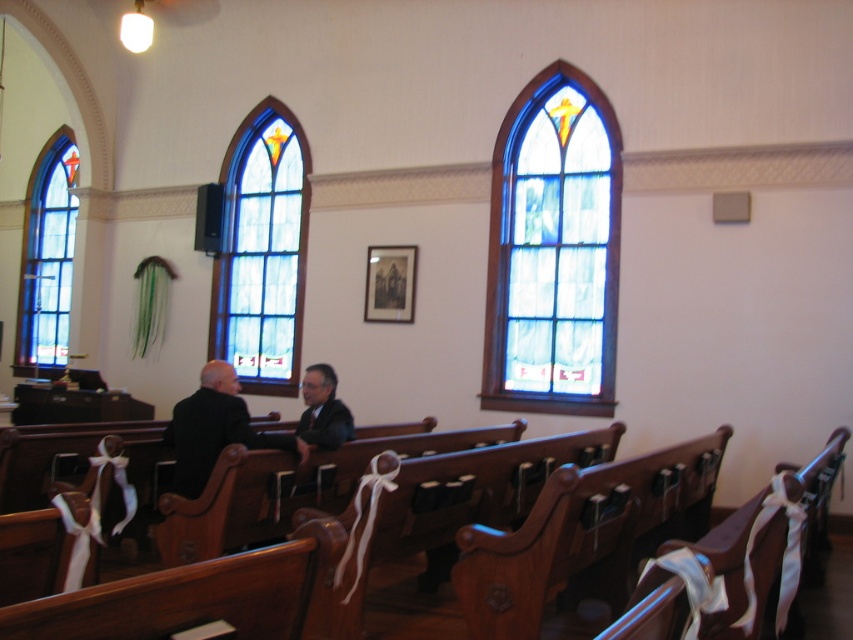
Which is above, stained glass at right or blue stained glass window at center?

Positioned higher is blue stained glass window at center.

This screenshot has width=853, height=640. In order to click on stained glass at right in this screenshot , I will do `click(553, 250)`.

Does point (563, 314) come closer to viewer compared to point (38, 196)?

That is True.

Based on the photo, which of these two, stained glass at right or blue stained glass window at left, stands shorter?

With less height is blue stained glass window at left.

I want to click on stained glass at right, so click(x=553, y=250).

The width and height of the screenshot is (853, 640). In order to click on stained glass at right in this screenshot , I will do `click(553, 250)`.

Describe the element at coordinates (262, 250) in the screenshot. I see `blue stained glass window at center` at that location.

Looking at this image, is blue stained glass window at center shorter than blue stained glass window at left?

No, blue stained glass window at center is not shorter than blue stained glass window at left.

Consider the image. Who is more distant from viewer, (254, 252) or (32, 268)?

Point (32, 268)

You are a GUI agent. You are given a task and a screenshot of the screen. Output one action in this format:
    pyautogui.click(x=<x>, y=<y>)
    Task: Click on the blue stained glass window at center
    This screenshot has width=853, height=640.
    Given the screenshot: What is the action you would take?
    pyautogui.click(x=262, y=250)